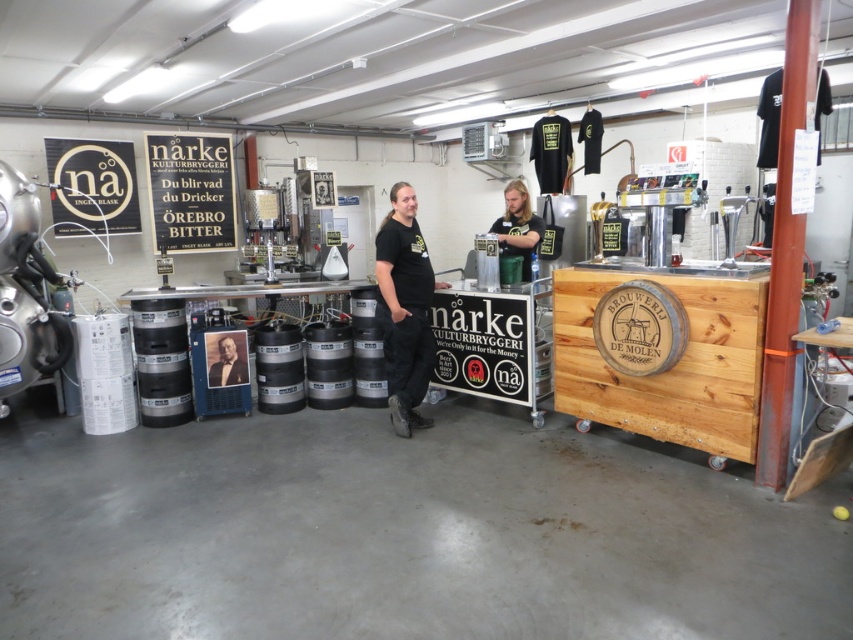
You are a fashion designer observing a photoshoot setup in a brewery. You notice a dark brown leather jacket at center and a formal black suit at center. Which clothing item appears taller in the photo?

The dark brown leather jacket at center has a greater height compared to the formal black suit at center, so the dark brown leather jacket at center appears taller in the photo.